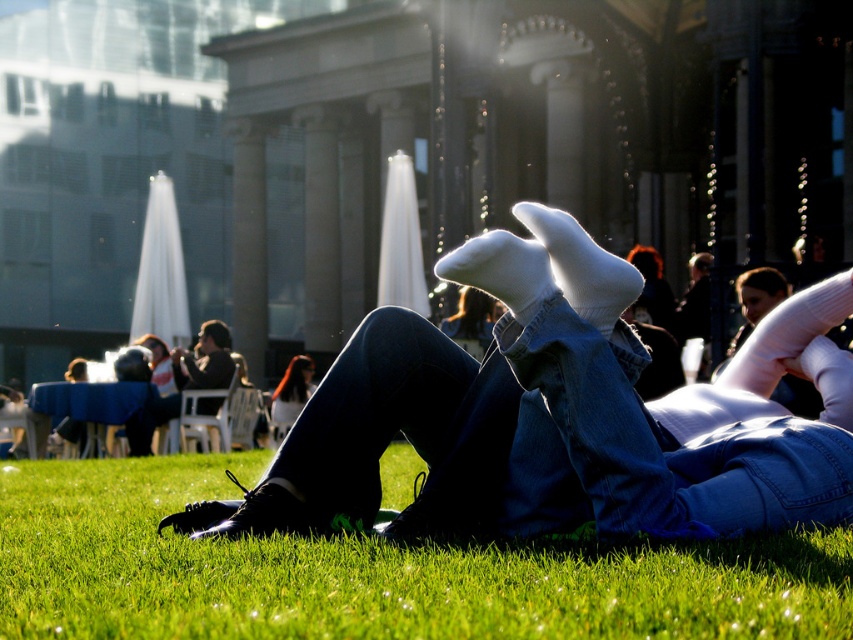
Question: Can you confirm if denim jeans at center is positioned to the left of white cotton socks at center?

Choices:
 (A) yes
 (B) no

Answer: (B)

Question: Can you confirm if dark brown leather jacket at upper left is positioned above blonde hair at center?

Choices:
 (A) no
 (B) yes

Answer: (B)

Question: Which is farther from the white cotton socks at center?

Choices:
 (A) dark brown leather jacket at upper left
 (B) blonde hair at center
 (C) green grass at lower center
 (D) denim jeans at center

Answer: (D)

Question: Which object is farther from the camera taking this photo?

Choices:
 (A) white cotton socks at center
 (B) dark brown leather jacket at upper left

Answer: (B)

Question: Does dark brown leather jacket at upper left have a greater width compared to blonde hair at center?

Choices:
 (A) no
 (B) yes

Answer: (B)

Question: Which object is farther from the camera taking this photo?

Choices:
 (A) denim jeans at center
 (B) blonde hair at center
 (C) dark brown leather jacket at upper left
 (D) green grass at lower center

Answer: (B)